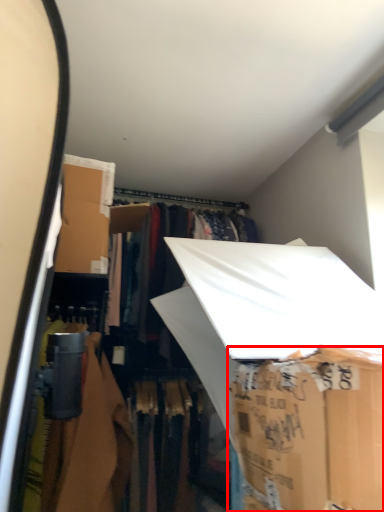
Question: From the image's perspective, where is storage box (annotated by the red box) located relative to storage box?

Choices:
 (A) above
 (B) below

Answer: (B)